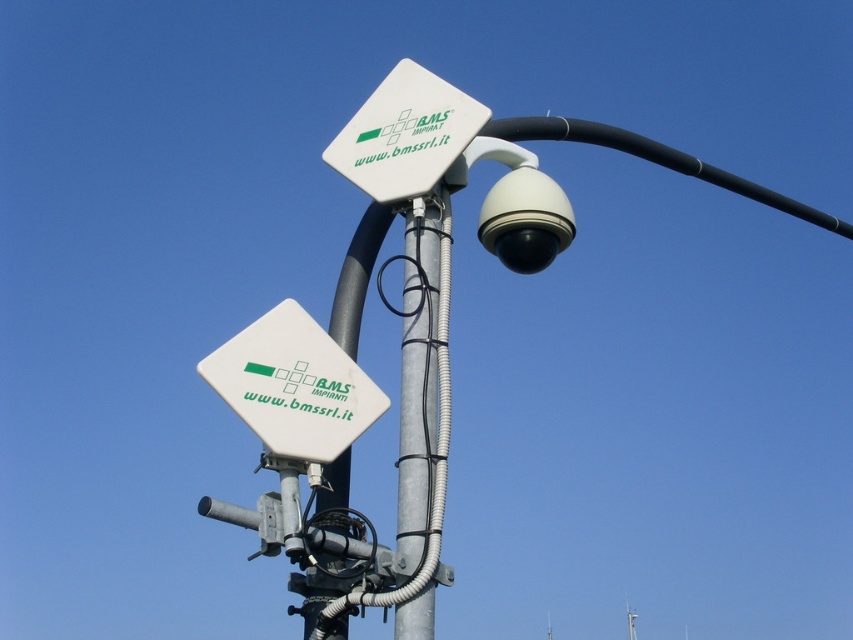
Question: Is silver metallic pole at center wider than white plastic pole at center?

Choices:
 (A) yes
 (B) no

Answer: (A)

Question: Which object is positioned closest to the white plastic sign at upper center?

Choices:
 (A) white matte sign at upper left
 (B) white plastic pole at center

Answer: (B)

Question: Is white plastic sign at upper center wider than white plastic pole at center?

Choices:
 (A) no
 (B) yes

Answer: (B)

Question: Which of the following is the closest to the observer?

Choices:
 (A) white plastic sign at upper center
 (B) silver metallic pole at center
 (C) white plastic pole at center
 (D) white matte sign at upper left

Answer: (D)

Question: Which point is closer to the camera taking this photo?

Choices:
 (A) (405, 273)
 (B) (347, 422)

Answer: (B)

Question: Is silver metallic pole at center above white plastic sign at upper center?

Choices:
 (A) no
 (B) yes

Answer: (A)